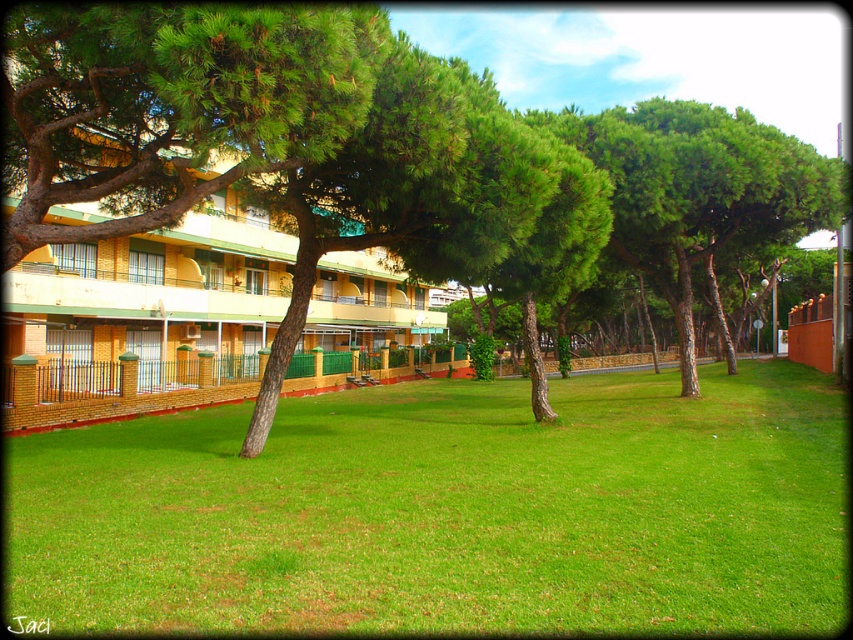
Consider the image. Can you confirm if green grass at center is positioned to the left of yellow wood hotel at left?

In fact, green grass at center is to the right of yellow wood hotel at left.

At what (x,y) coordinates should I click in order to perform the action: click on green grass at center. Please return your answer as a coordinate pair (x, y). This screenshot has width=853, height=640. Looking at the image, I should click on (448, 512).

Does point (25, 605) come farther from viewer compared to point (178, 243)?

No, it is in front of (178, 243).

Locate an element on the screen. green grass at center is located at coordinates (448, 512).